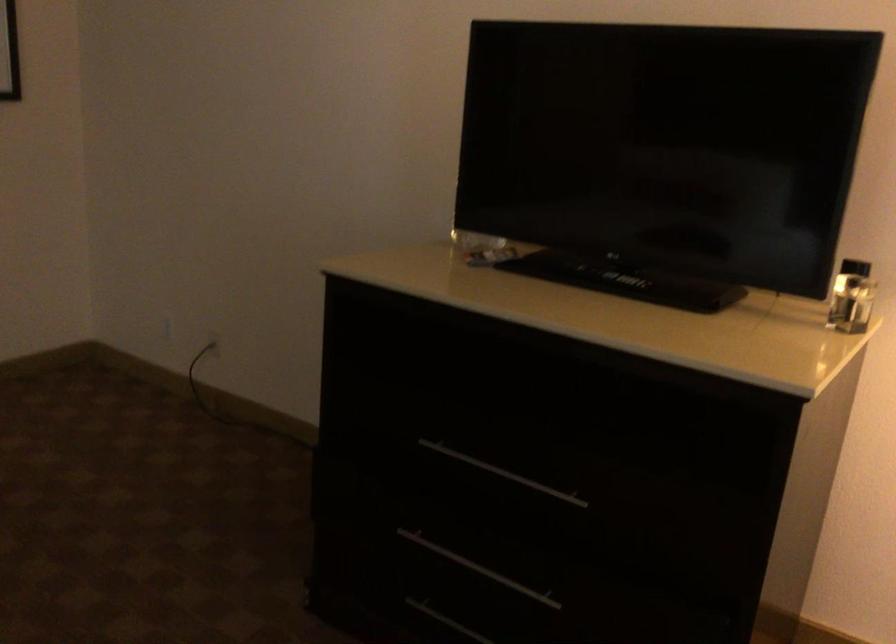
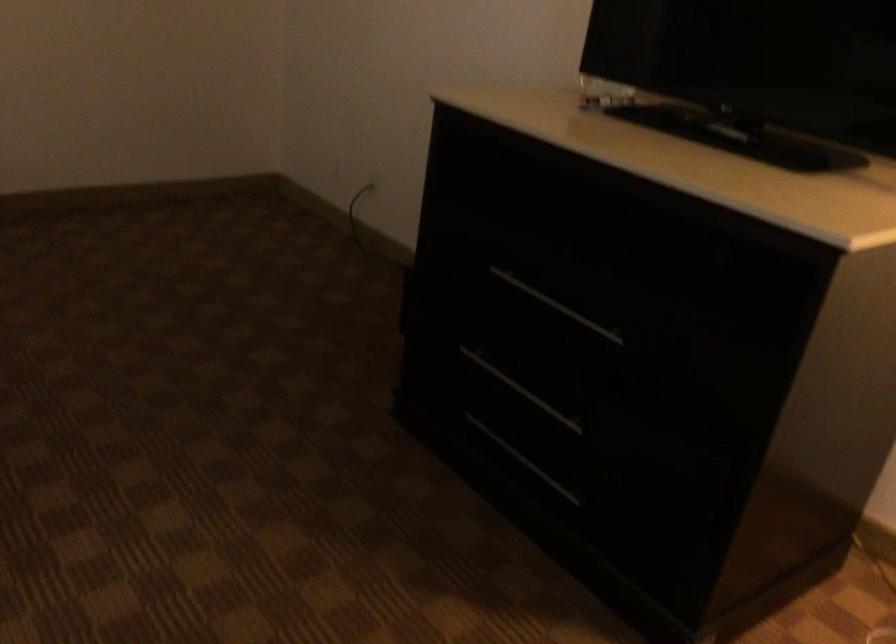
Question: Based on the continuous images, in which direction is the camera rotating? Reply with the corresponding letter.

Choices:
 (A) Left
 (B) Right
 (C) Up
 (D) Down

Answer: (A)